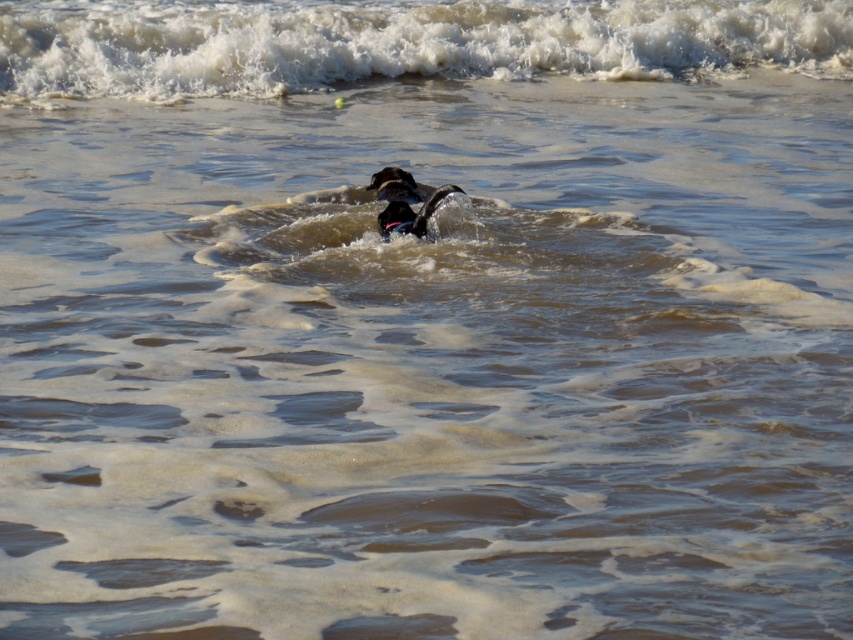
You are a photographer trying to capture the black matte dog at center and the white frothy wave at upper center in a single shot. Which of the two objects will appear smaller in the photo?

The white frothy wave at upper center will appear smaller in the photo because it occupies less space than the black matte dog at center.

You are standing on the beach and see the white frothy wave at upper center and the shiny black dog at center. Which object is closer to you?

The white frothy wave at upper center is closer to you because it is further to the viewer than the shiny black dog at center.